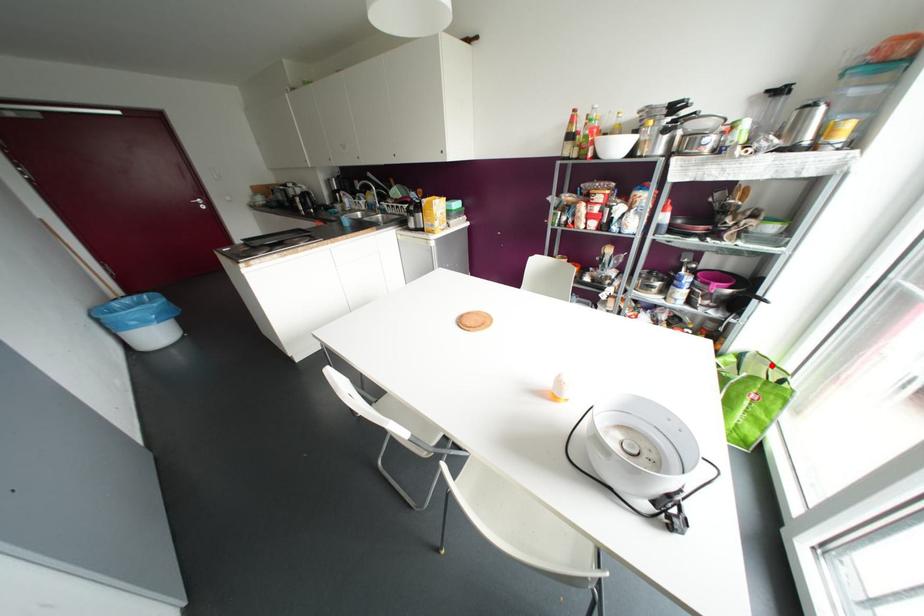
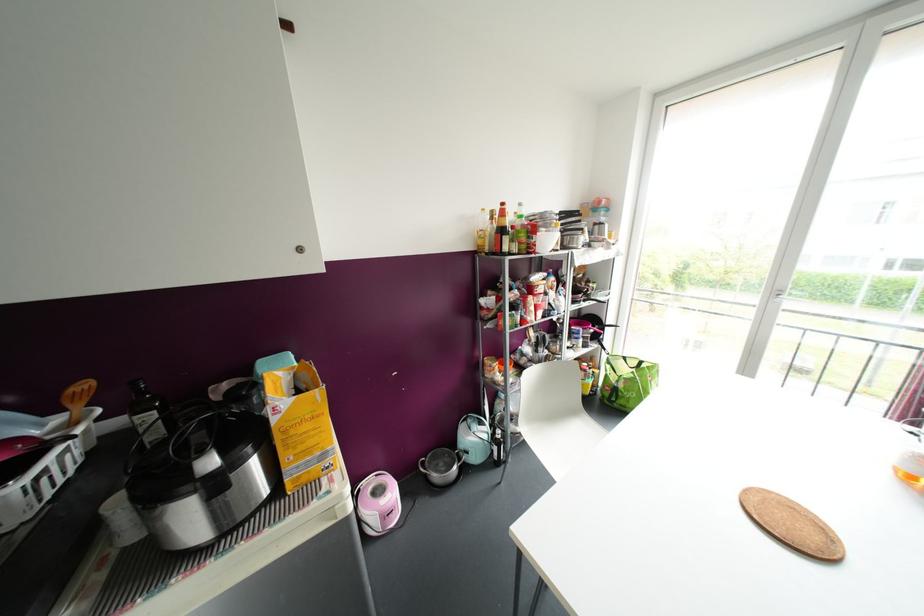
In the second image, find the point that corresponds to the highlighted location in the first image.

(624, 358)